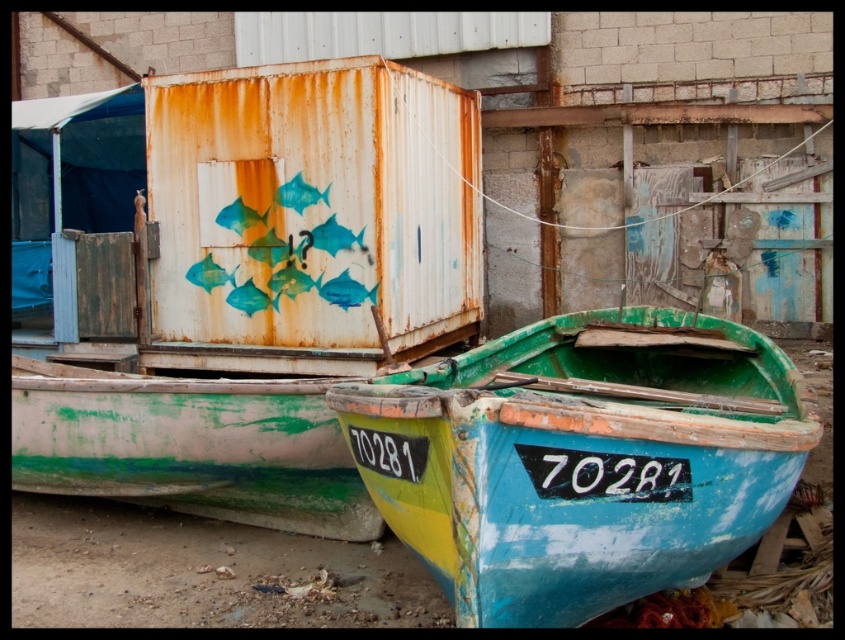
You are standing in front of the weathered building and see the point marked at coordinates (x=582, y=460). Which object is located at that point?

The point at coordinates (x=582, y=460) indicates the green painted wood boat at center.

You are a photographer trying to capture both the green painted wood boat at center and the rusty metal shipping container at upper center in a single frame. Based on their sizes, which object should you move closer to in order to include both in the frame without cropping?

The green painted wood boat at center is smaller than the rusty metal shipping container at upper center. To include both in the frame without cropping, you should move closer to the green painted wood boat at center so that it appears larger relative to the shipping container, allowing both to fit within the frame.

You are standing in front of the green painted wood boat at center and want to see the rusty metal shipping container at upper center behind it. Is the shipping container fully visible or partially blocked?

The green painted wood boat at center is in front of the rusty metal shipping container at upper center, so the shipping container is partially blocked by the boat.